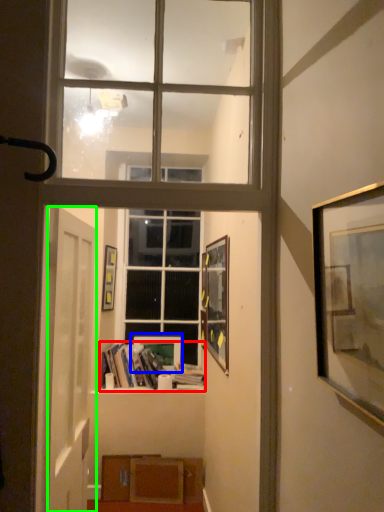
Question: Estimate the real-world distances between objects in this image. Which object is closer to book (highlighted by a red box), picture frame (highlighted by a blue box) or door (highlighted by a green box)?

Choices:
 (A) picture frame
 (B) door

Answer: (A)